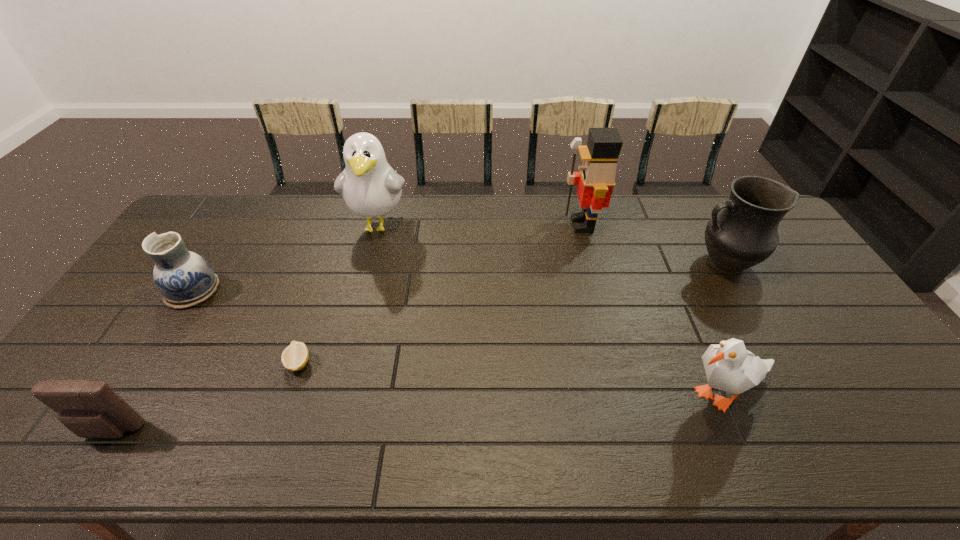
In order to click on free space at the left edge in this screenshot , I will do `click(201, 252)`.

In the image, there is a desktop. Where is `free space at the right edge`? free space at the right edge is located at coordinates (837, 338).

The width and height of the screenshot is (960, 540). I want to click on blank area at the near right corner, so click(x=897, y=448).

The height and width of the screenshot is (540, 960). Identify the location of free space between the farther gull and the pouch. (245, 328).

The image size is (960, 540). Identify the location of free space that is in between the lemon and the left gull. (339, 294).

Find the location of a particular element. vacant space in between the pitcher and the pottery is located at coordinates (458, 277).

Identify the location of vacant area between the lemon and the nearer gull. Image resolution: width=960 pixels, height=540 pixels. (511, 379).

The height and width of the screenshot is (540, 960). I want to click on unoccupied position between the sixth tallest object and the pottery, so click(152, 361).

This screenshot has width=960, height=540. I want to click on vacant region between the lemon and the pouch, so click(204, 397).

This screenshot has height=540, width=960. In order to click on empty location between the left gull and the pitcher in this screenshot , I will do `click(551, 245)`.